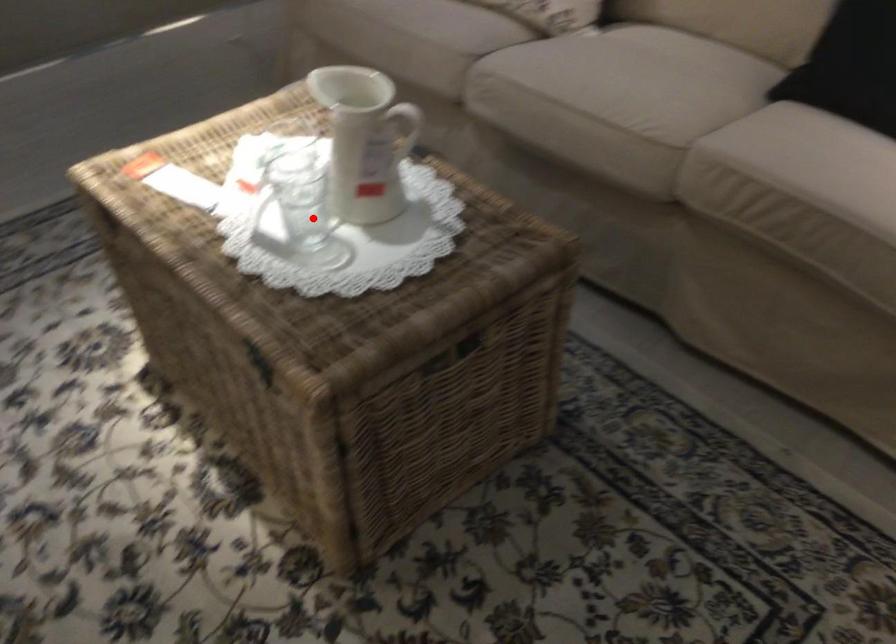
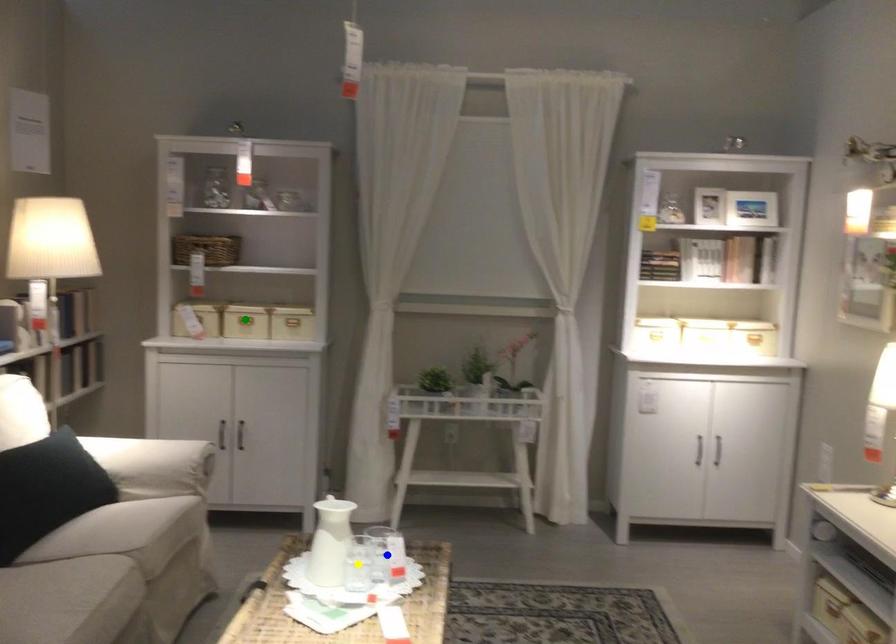
Question: I am providing you with two images of the same scene from different viewpoints. A red point is marked on the first image. You are given multiple points on the second image. Which spot in image 2 lines up with the point in image 1?

Choices:
 (A) blue point
 (B) yellow point
 (C) green point

Answer: (A)